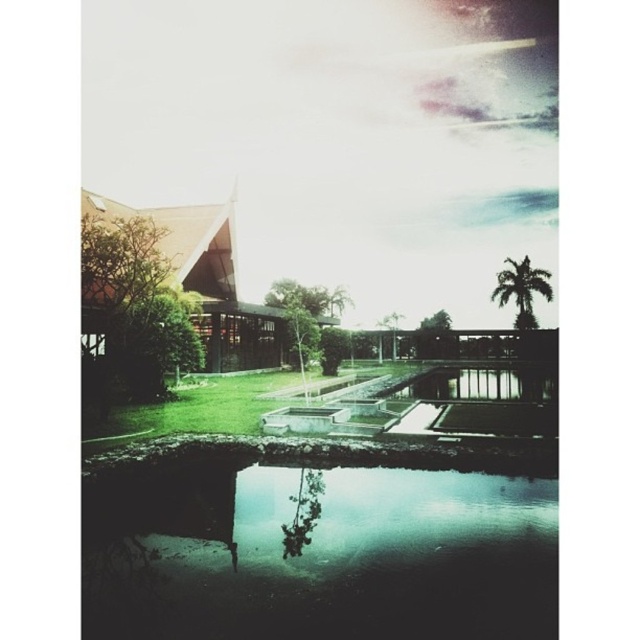
You are standing at the viewpoint of the image and want to walk to both points marked in the scene. Which point, point (227, 548) or point (512, 285), will you reach first?

You will reach point (227, 548) first because it is closer to the viewer than point (512, 285).

You are standing at the edge of the green reflective water at bottom and want to walk to the green leafy palm tree at upper right. Which direction should you head to reach it?

You should head towards the upper right direction to reach the green leafy palm tree at upper right since it is located at the upper right position relative to the green reflective water at bottom.